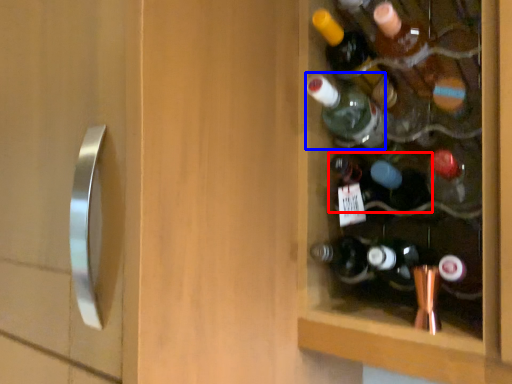
Question: Among these objects, which one is nearest to the camera, bottle (highlighted by a red box) or bottle (highlighted by a blue box)?

Choices:
 (A) bottle
 (B) bottle

Answer: (A)